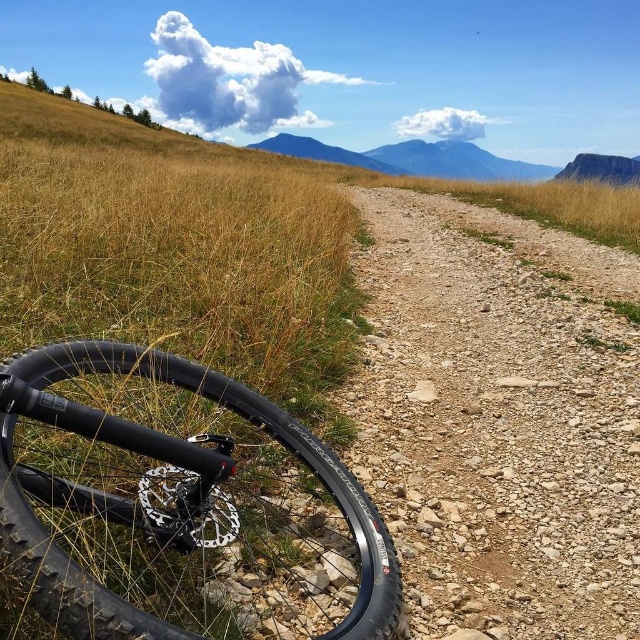
Question: In this image, where is dusty gravel path at center located relative to black rubber tire at lower left?

Choices:
 (A) right
 (B) left

Answer: (A)

Question: Which of the following is the closest to the observer?

Choices:
 (A) (339, 461)
 (B) (492, 214)

Answer: (A)

Question: Is dusty gravel path at center bigger than black rubber tire at lower left?

Choices:
 (A) no
 (B) yes

Answer: (B)

Question: From the image, what is the correct spatial relationship of dusty gravel path at center in relation to black rubber tire at lower left?

Choices:
 (A) above
 (B) below

Answer: (A)

Question: Among these objects, which one is farthest from the camera?

Choices:
 (A) dusty gravel path at center
 (B) black rubber tire at lower left

Answer: (A)